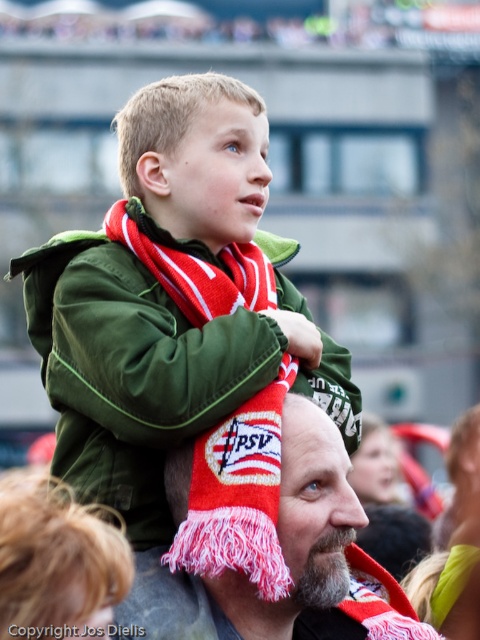
You are a photographer at the event and want to capture a closeup of the red knitted scarf at center. Based on the coordinates provided in the Objects Description, where should you aim your camera?

The red knitted scarf at center is located at point (155,371), so you should aim your camera at those coordinates to capture the closeup.